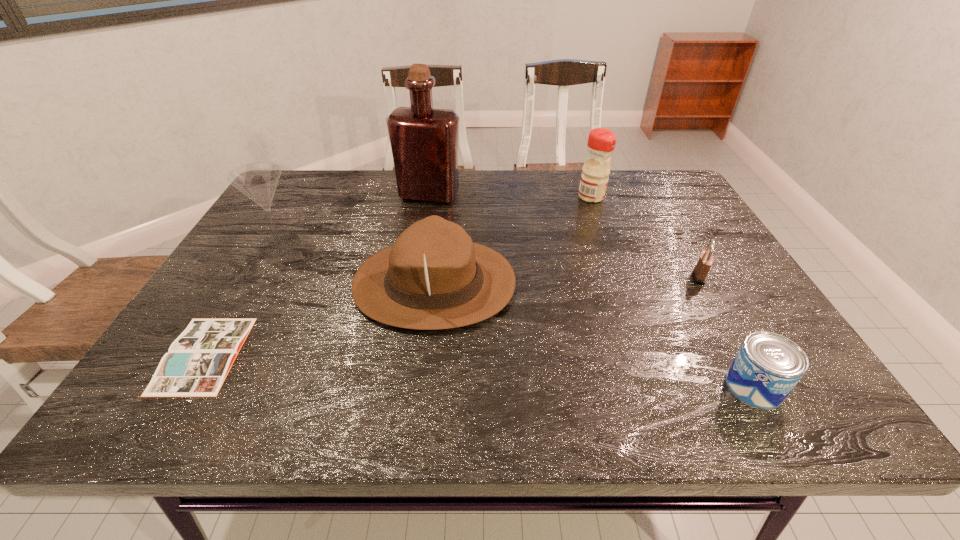
You are a GUI agent. You are given a task and a screenshot of the screen. Output one action in this format:
    pyautogui.click(x=<x>, y=<y>)
    Task: Click on the vacant space located on the feather side of the fedora
    The height and width of the screenshot is (540, 960).
    Given the screenshot: What is the action you would take?
    pyautogui.click(x=636, y=284)

Where is `free space located 0.130m on the back of the padlock`? This screenshot has height=540, width=960. free space located 0.130m on the back of the padlock is located at coordinates (677, 238).

Identify the location of free location located 0.300m on the right of the shortest object. (386, 355).

Locate an element on the screen. liquor present at the far edge is located at coordinates (424, 141).

The width and height of the screenshot is (960, 540). I want to click on condiment that is at the far edge, so point(595,173).

You are a GUI agent. You are given a task and a screenshot of the screen. Output one action in this format:
    pyautogui.click(x=<x>, y=<y>)
    Task: Click on the can situated at the near edge
    This screenshot has width=960, height=540.
    Given the screenshot: What is the action you would take?
    pyautogui.click(x=767, y=367)

You are a GUI agent. You are given a task and a screenshot of the screen. Output one action in this format:
    pyautogui.click(x=<x>, y=<y>)
    Task: Click on the book at the near edge
    
    Given the screenshot: What is the action you would take?
    pyautogui.click(x=199, y=360)

Locate an element on the screen. flute glass located in the left edge section of the desktop is located at coordinates (258, 181).

The image size is (960, 540). I want to click on book that is at the left edge, so click(x=199, y=360).

The height and width of the screenshot is (540, 960). I want to click on padlock that is at the right edge, so [x=700, y=272].